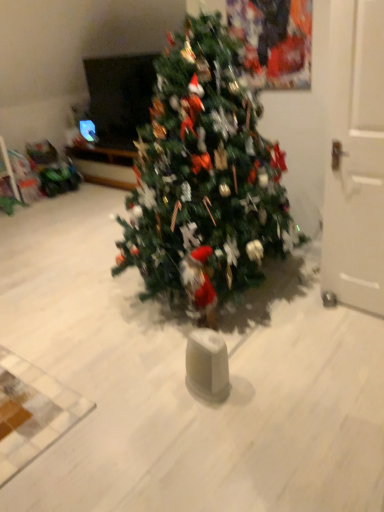
The image size is (384, 512). I want to click on white matte door at right, so click(356, 157).

What do you see at coordinates (356, 157) in the screenshot? I see `white matte door at right` at bounding box center [356, 157].

Where is `green matte christmas tree at center`? green matte christmas tree at center is located at coordinates (203, 178).

What do you see at coordinates (203, 178) in the screenshot? Image resolution: width=384 pixels, height=512 pixels. I see `green matte christmas tree at center` at bounding box center [203, 178].

Locate an element on the screen. white matte door at right is located at coordinates (356, 157).

Considering the relative positions of green matte christmas tree at center and white matte door at right in the image provided, is green matte christmas tree at center to the left of white matte door at right from the viewer's perspective?

Yes, green matte christmas tree at center is to the left of white matte door at right.

Which is in front, green matte christmas tree at center or white matte door at right?

Answer: green matte christmas tree at center.

Which point is more distant from viewer, (190, 35) or (370, 246)?

The point (190, 35) is farther.

From the image's perspective, is green matte christmas tree at center under white matte door at right?

No, from the image's perspective, green matte christmas tree at center is not below white matte door at right.

From a real-world perspective, who is located lower, green matte christmas tree at center or white matte door at right?

In real-world perspective, white matte door at right is lower.

Can you confirm if green matte christmas tree at center is thinner than white matte door at right?

Incorrect, the width of green matte christmas tree at center is not less than that of white matte door at right.

Does green matte christmas tree at center have a lesser height compared to white matte door at right?

Incorrect, the height of green matte christmas tree at center does not fall short of that of white matte door at right.

Based on the photo, does green matte christmas tree at center have a larger size compared to white matte door at right?

Indeed, green matte christmas tree at center has a larger size compared to white matte door at right.

Looking at this image, choose the correct answer: Is green matte christmas tree at center inside white matte door at right or outside it?

The correct answer is: outside.

Is green matte christmas tree at center positioned far away from white matte door at right?

green matte christmas tree at center is actually quite close to white matte door at right.

In the scene shown: Is green matte christmas tree at center oriented towards white matte door at right?

No, green matte christmas tree at center is not facing towards white matte door at right.

Where is `door lying on the right of green matte christmas tree at center`? This screenshot has height=512, width=384. door lying on the right of green matte christmas tree at center is located at coordinates (356, 157).

Is white matte door at right to the left or to the right of green matte christmas tree at center in the image?

white matte door at right is positioned on green matte christmas tree at center's right side.

Looking at this image, does white matte door at right come behind green matte christmas tree at center?

Yes, white matte door at right is further from the viewer.

Which is closer to the camera, (336, 90) or (254, 100)?

Point (336, 90) is positioned closer to the camera compared to point (254, 100).

Based on the photo, from the image's perspective, would you say white matte door at right is positioned over green matte christmas tree at center?

No.

From the picture: From a real-world perspective, which is physically below, white matte door at right or green matte christmas tree at center?

In real-world perspective, white matte door at right is lower.

In terms of width, does white matte door at right look wider or thinner when compared to green matte christmas tree at center?

white matte door at right is thinner than green matte christmas tree at center.

Based on the photo, from their relative heights in the image, would you say white matte door at right is taller or shorter than green matte christmas tree at center?

Considering their sizes, white matte door at right has less height than green matte christmas tree at center.

Based on the photo, between white matte door at right and green matte christmas tree at center, which one has larger size?

With larger size is green matte christmas tree at center.

Would you say white matte door at right is outside green matte christmas tree at center?

Yes.

Is white matte door at right touching green matte christmas tree at center?

white matte door at right and green matte christmas tree at center are clearly separated.

Could you tell me if white matte door at right is facing green matte christmas tree at center?

No, white matte door at right is not aimed at green matte christmas tree at center.

How different are the orientations of white matte door at right and green matte christmas tree at center in degrees?

The facing directions of white matte door at right and green matte christmas tree at center are 4.24 degrees apart.

You are a GUI agent. You are given a task and a screenshot of the screen. Output one action in this format:
    pyautogui.click(x=<x>, y=<y>)
    Task: Click on the christmas tree lying on the left of white matte door at right
    
    Given the screenshot: What is the action you would take?
    pyautogui.click(x=203, y=178)

Where is `christmas tree located on the left of white matte door at right`? This screenshot has width=384, height=512. christmas tree located on the left of white matte door at right is located at coordinates (203, 178).

Find the location of a particular element. The height and width of the screenshot is (512, 384). door behind the green matte christmas tree at center is located at coordinates (356, 157).